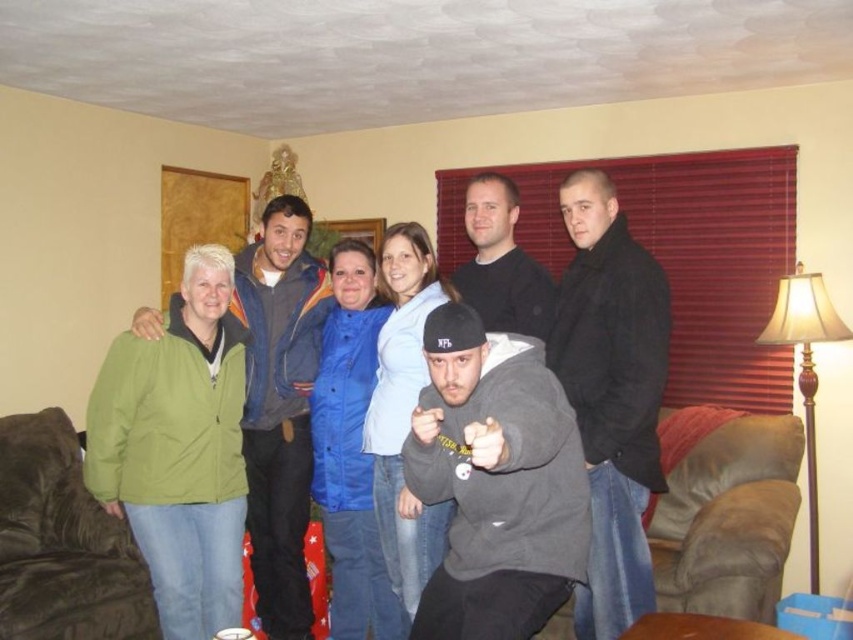
Question: Observing the image, what is the correct spatial positioning of gray matte hoodie at center in reference to green matte jacket at left?

Choices:
 (A) right
 (B) left

Answer: (A)

Question: Does gray matte hoodie at center appear over green matte jacket at left?

Choices:
 (A) yes
 (B) no

Answer: (B)

Question: Which object appears farthest from the camera in this image?

Choices:
 (A) gray matte hoodie at center
 (B) green matte jacket at left

Answer: (B)

Question: Is gray matte hoodie at center above green matte jacket at left?

Choices:
 (A) no
 (B) yes

Answer: (A)